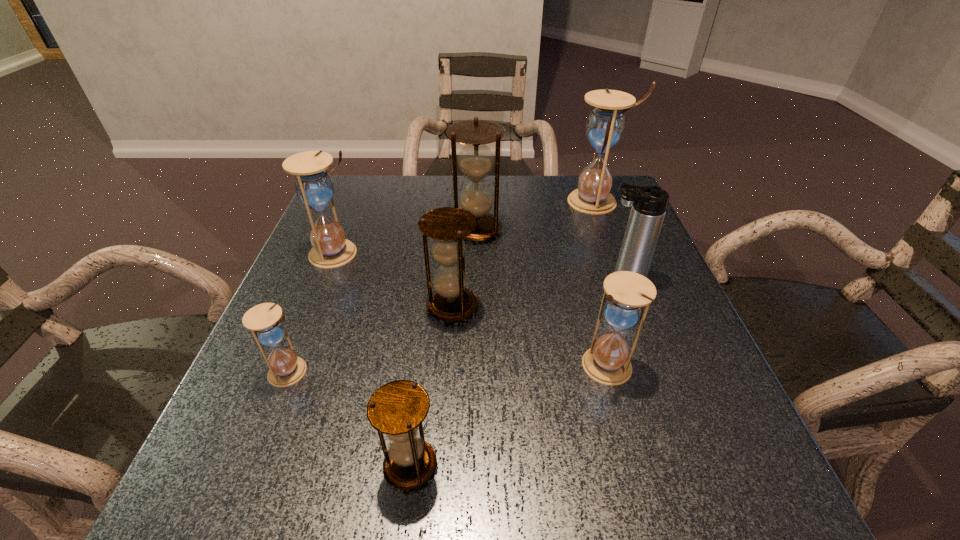
Locate which hourglass is the closest to the farthest hourglass. Please provide its 2D coordinates. Your answer should be formatted as a tuple, i.e. [(x, y)], where the tuple contains the x and y coordinates of a point satisfying the conditions above.

[(475, 160)]

Locate which hourglass ranks sixth in proximity to the thermos bottle. Please provide its 2D coordinates. Your answer should be formatted as a tuple, i.e. [(x, y)], where the tuple contains the x and y coordinates of a point satisfying the conditions above.

[(314, 187)]

Locate an element on the screen. white hourglass that is the closest to the second smallest white hourglass is located at coordinates (605, 126).

Where is `the second closest white hourglass to the biggest brown hourglass`? This screenshot has width=960, height=540. the second closest white hourglass to the biggest brown hourglass is located at coordinates (314, 187).

Where is `brown hourglass that is the third closest to the second biggest white hourglass`? brown hourglass that is the third closest to the second biggest white hourglass is located at coordinates (397, 409).

Image resolution: width=960 pixels, height=540 pixels. Identify the location of brown hourglass that is the second closest to the thermos bottle. (451, 301).

Where is `vacant region that satisfies the following two spatial constraints: 1. on the front side of the second smallest white hourglass; 2. on the left side of the second smallest brown hourglass`? Image resolution: width=960 pixels, height=540 pixels. vacant region that satisfies the following two spatial constraints: 1. on the front side of the second smallest white hourglass; 2. on the left side of the second smallest brown hourglass is located at coordinates (448, 366).

This screenshot has height=540, width=960. Find the location of `vacant region that satisfies the following two spatial constraints: 1. on the back side of the fourth farthest hourglass; 2. on the left side of the smallest brown hourglass`. vacant region that satisfies the following two spatial constraints: 1. on the back side of the fourth farthest hourglass; 2. on the left side of the smallest brown hourglass is located at coordinates (430, 306).

Where is `free space that satisfies the following two spatial constraints: 1. on the handle side of the thermos bottle; 2. on the front side of the nearest hourglass`? free space that satisfies the following two spatial constraints: 1. on the handle side of the thermos bottle; 2. on the front side of the nearest hourglass is located at coordinates (689, 465).

Locate an element on the screen. free spot that satisfies the following two spatial constraints: 1. on the front side of the second farthest white hourglass; 2. on the left side of the smallest brown hourglass is located at coordinates (253, 465).